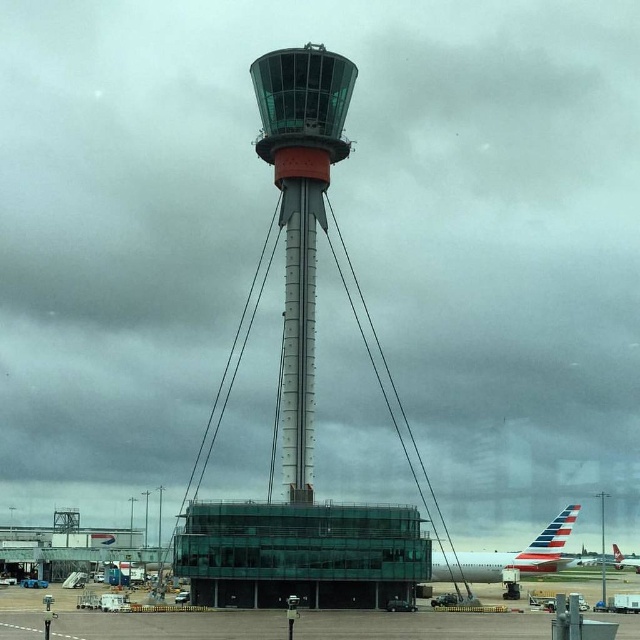
Question: Estimate the real-world distances between objects in this image. Which object is farther from the polished aluminum airplane at lower right?

Choices:
 (A) transparent glass tower at center
 (B) glassy steel tower at center
 (C) smooth concrete tarmac at lower center
 (D) metallic silver airplane at lower right

Answer: (D)

Question: Is smooth concrete tarmac at lower center below metallic silver airplane at lower right?

Choices:
 (A) no
 (B) yes

Answer: (A)

Question: Does transparent glass tower at center have a smaller size compared to metallic silver airplane at lower right?

Choices:
 (A) no
 (B) yes

Answer: (A)

Question: Which of these objects is positioned farthest from the polished aluminum airplane at lower right?

Choices:
 (A) transparent glass tower at center
 (B) smooth concrete tarmac at lower center

Answer: (A)

Question: Does smooth concrete tarmac at lower center have a greater width compared to metallic silver airplane at lower right?

Choices:
 (A) no
 (B) yes

Answer: (B)

Question: Which object appears farthest from the camera in this image?

Choices:
 (A) glassy steel tower at center
 (B) transparent glass tower at center
 (C) smooth concrete tarmac at lower center

Answer: (A)